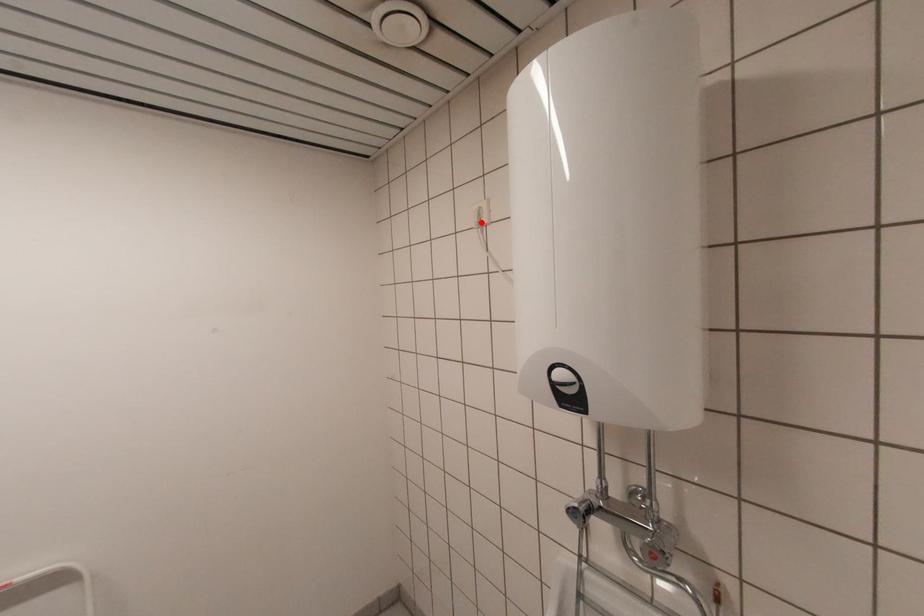
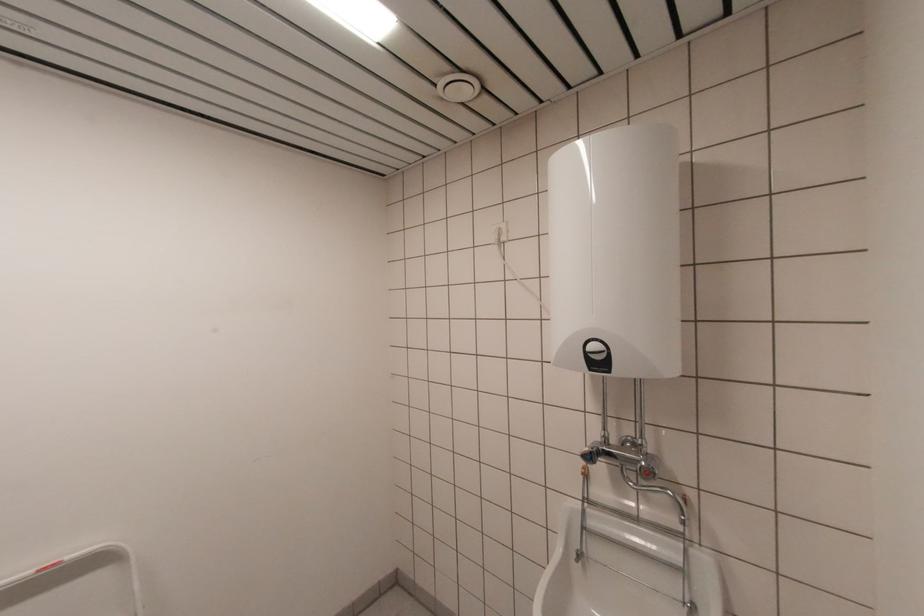
Find the pixel in the second image that matches the highlighted location in the first image.

(501, 240)